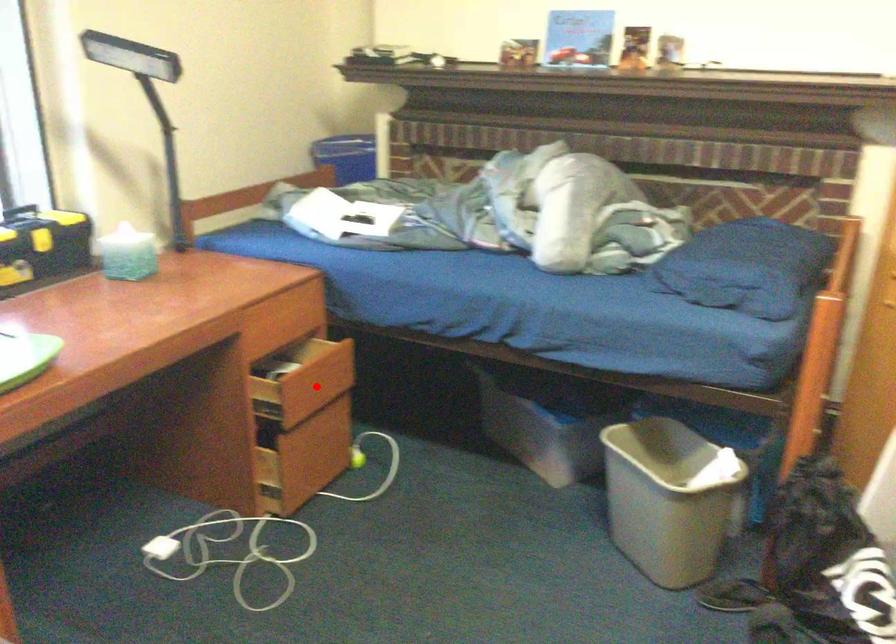
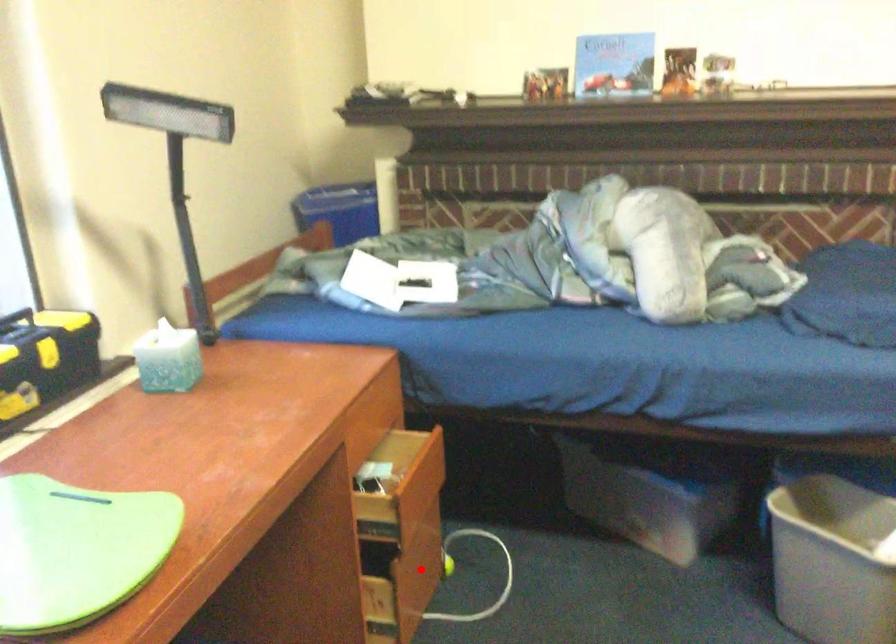
I am providing you with two images of the same scene from different viewpoints. A red point is marked on the first image and another point is marked on the second image. Are the points marked in image1 and image2 representing the same 3D position?

No